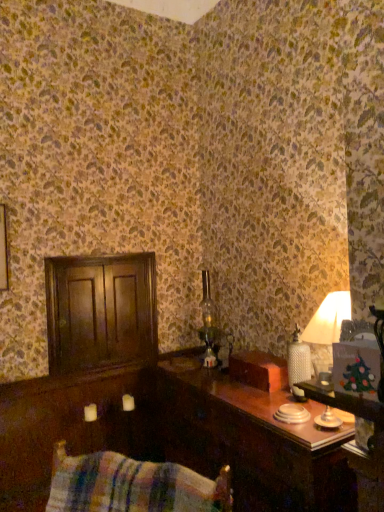
Question: Is dark wood dresser at left positioned far away from wooden table at right?

Choices:
 (A) no
 (B) yes

Answer: (A)

Question: Is dark wood dresser at left positioned with its back to wooden table at right?

Choices:
 (A) no
 (B) yes

Answer: (A)

Question: Can we say dark wood dresser at left lies outside wooden table at right?

Choices:
 (A) no
 (B) yes

Answer: (B)

Question: Is dark wood dresser at left thinner than wooden table at right?

Choices:
 (A) no
 (B) yes

Answer: (B)

Question: From a real-world perspective, is dark wood dresser at left located beneath wooden table at right?

Choices:
 (A) no
 (B) yes

Answer: (A)

Question: From the image's perspective, is dark wood dresser at left above wooden table at right?

Choices:
 (A) yes
 (B) no

Answer: (A)

Question: Is wooden table at right to the left of dark wood dresser at left from the viewer's perspective?

Choices:
 (A) yes
 (B) no

Answer: (B)

Question: Is wooden table at right taller than dark wood dresser at left?

Choices:
 (A) no
 (B) yes

Answer: (B)

Question: Considering the relative sizes of wooden table at right and dark wood dresser at left in the image provided, is wooden table at right thinner than dark wood dresser at left?

Choices:
 (A) no
 (B) yes

Answer: (A)

Question: Is wooden table at right wider than dark wood dresser at left?

Choices:
 (A) yes
 (B) no

Answer: (A)

Question: From a real-world perspective, is wooden table at right located higher than dark wood dresser at left?

Choices:
 (A) no
 (B) yes

Answer: (A)

Question: Are wooden table at right and dark wood dresser at left located far from each other?

Choices:
 (A) yes
 (B) no

Answer: (B)

Question: From the image's perspective, would you say dark wood dresser at left is positioned over plaid fabric swivel chair at lower left?

Choices:
 (A) no
 (B) yes

Answer: (B)